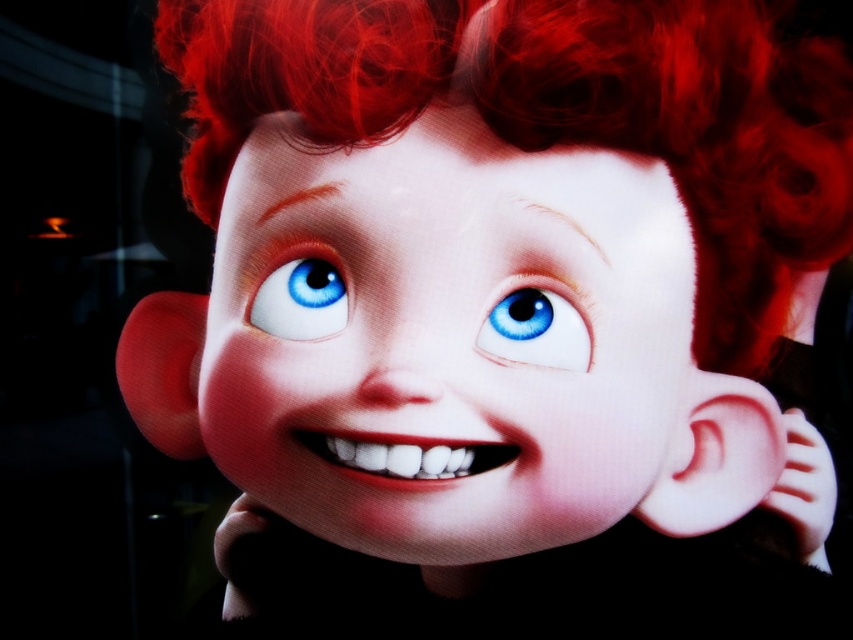
From the picture: You are an animator checking the proportions of an animated character. The character has a smooth skin face at center and a blue glossy eye at center. According to the image, which object takes up more space?

The smooth skin face at center is bigger than the blue glossy eye at center, so the smooth skin face at center takes up more space.

Based on the coordinates provided in the image, where is the smooth skin face at center positioned?

The smooth skin face at center is positioned at coordinates point (450, 340).

You are an animator working on a closeup of an animated character with vibrant red hair. You need to determine which of the two points, point (x=514, y=304) or point (x=329, y=324), is closer to the viewer. Can you tell me which one is closer?

Point (x=514, y=304) is closer to the viewer than point (x=329, y=324).